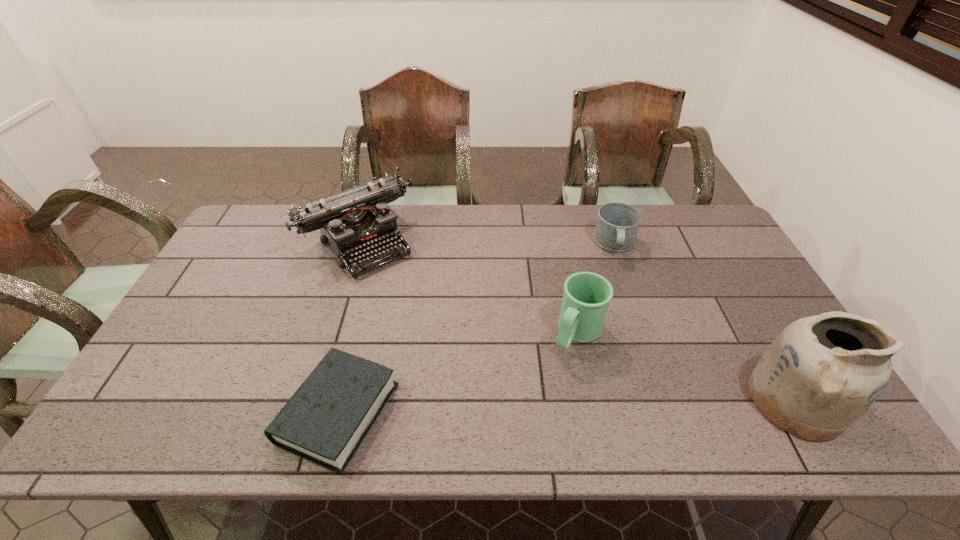
What are the coordinates of `vacant region that satisfies the following two spatial constraints: 1. on the front side of the tallest object; 2. on the right side of the farther mug` in the screenshot? It's located at (668, 400).

The width and height of the screenshot is (960, 540). In order to click on vacant position in the image that satisfies the following two spatial constraints: 1. on the front side of the typewriter; 2. on the left side of the third nearest object in this screenshot , I will do `click(329, 333)`.

You are a GUI agent. You are given a task and a screenshot of the screen. Output one action in this format:
    pyautogui.click(x=<x>, y=<y>)
    Task: Click on the free space that satisfies the following two spatial constraints: 1. on the front side of the fourth tallest object; 2. on the right side of the typewriter
    Image resolution: width=960 pixels, height=540 pixels.
    Given the screenshot: What is the action you would take?
    pyautogui.click(x=357, y=245)

This screenshot has height=540, width=960. In order to click on vacant point that satisfies the following two spatial constraints: 1. on the back side of the shorter mug; 2. on the left side of the shortest object in this screenshot , I will do `click(381, 245)`.